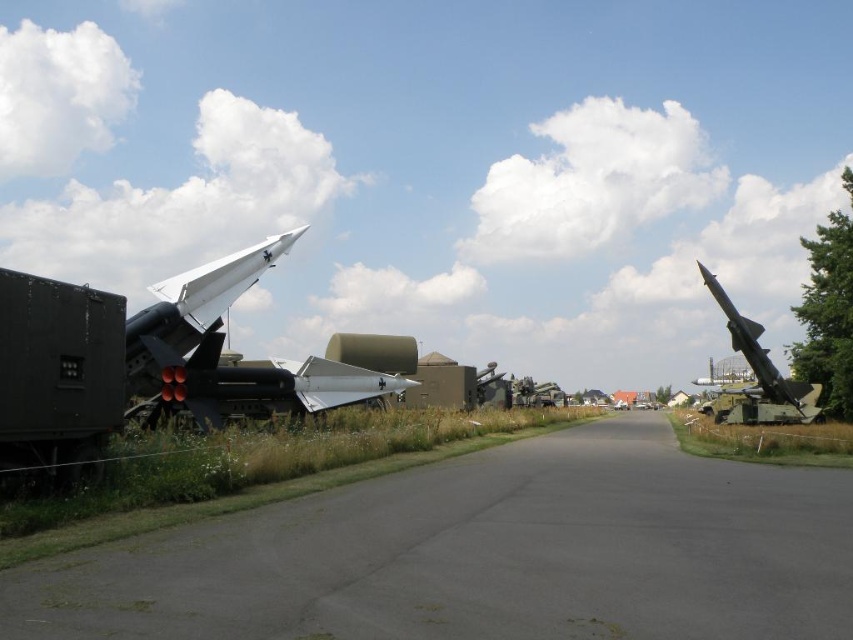
You are a military technician tasked with aligning a new missile launcher. You need to place a white matte missile at left at the exact coordinates of point (193,307). Can you confirm if the missile is already positioned correctly?

Yes, the white matte missile at left is already positioned correctly at point (193,307).

You are a military technician inspecting the missiles displayed on the road. You notice the white matte missile at left and the shiny metallic missile at right. Which missile has a narrower width?

The white matte missile at left has a lesser width compared to the shiny metallic missile at right, so it is narrower.

You are a military technician inspecting the missile display. You notice two points marked on the image at coordinates point [223,284] and point [730,416]. Which point is located closer to your position as the viewer?

Point [223,284] is closer to the viewer than point [730,416].